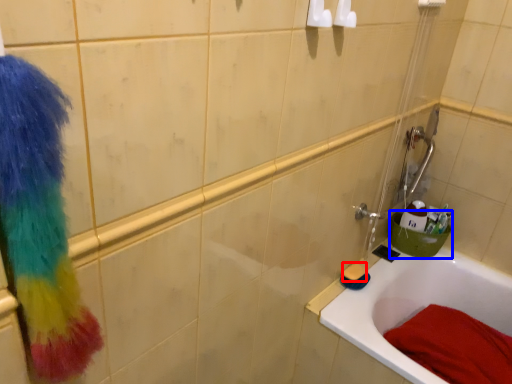
Question: Among these objects, which one is farthest to the camera, soap (highlighted by a red box) or basin (highlighted by a blue box)?

Choices:
 (A) soap
 (B) basin

Answer: (B)